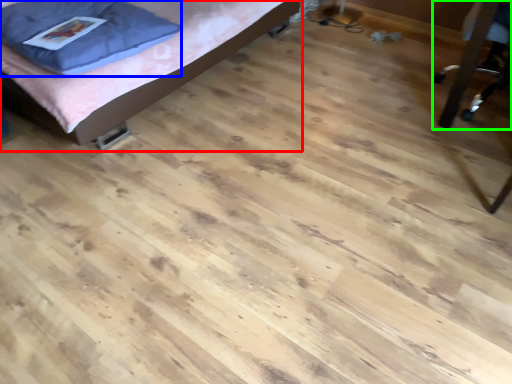
Question: Which is farther away from bed (highlighted by a red box)? pillow (highlighted by a blue box) or furniture (highlighted by a green box)?

Choices:
 (A) pillow
 (B) furniture

Answer: (B)